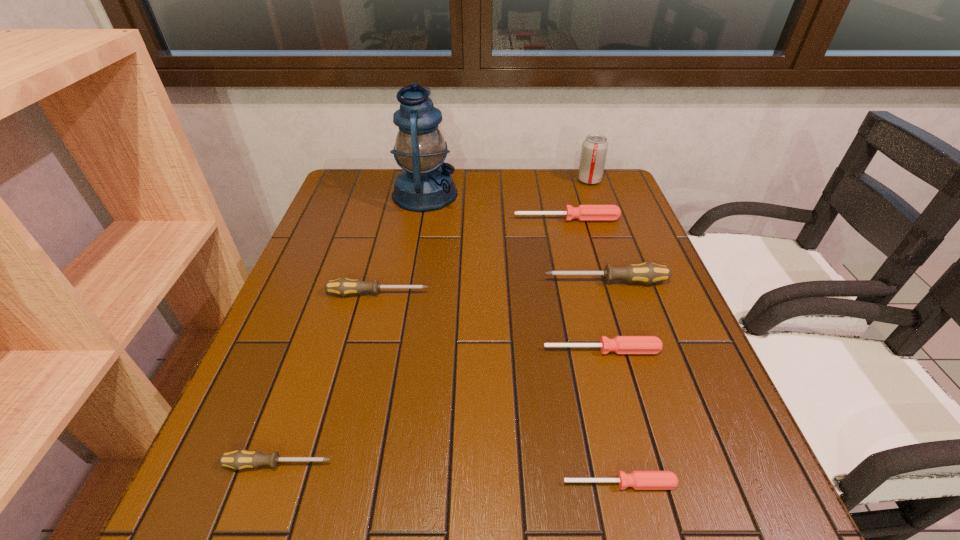
The width and height of the screenshot is (960, 540). Identify the location of object that is at the near right corner. (640, 480).

Where is `free space at the far edge`? free space at the far edge is located at coordinates (399, 168).

Find the location of `vacant space at the left edge of the desktop`. vacant space at the left edge of the desktop is located at coordinates (331, 333).

Find the location of `free point at the right edge`. free point at the right edge is located at coordinates (601, 232).

Locate an element on the screen. The width and height of the screenshot is (960, 540). free space at the far left corner is located at coordinates (372, 179).

Identify the location of vacant space at the far right corner of the desktop. The image size is (960, 540). (608, 168).

Where is `vacant space that's between the third nearest screwdriver and the nearest screwdriver`? This screenshot has width=960, height=540. vacant space that's between the third nearest screwdriver and the nearest screwdriver is located at coordinates (611, 417).

Image resolution: width=960 pixels, height=540 pixels. What are the coordinates of `vacant space that's between the gray soda can and the biggest gray screwdriver` in the screenshot? It's located at (598, 231).

Locate an element on the screen. Image resolution: width=960 pixels, height=540 pixels. vacant space that is in between the shortest object and the soda can is located at coordinates (605, 332).

In order to click on vacant point located between the second smallest gray screwdriver and the soda can in this screenshot , I will do `click(484, 237)`.